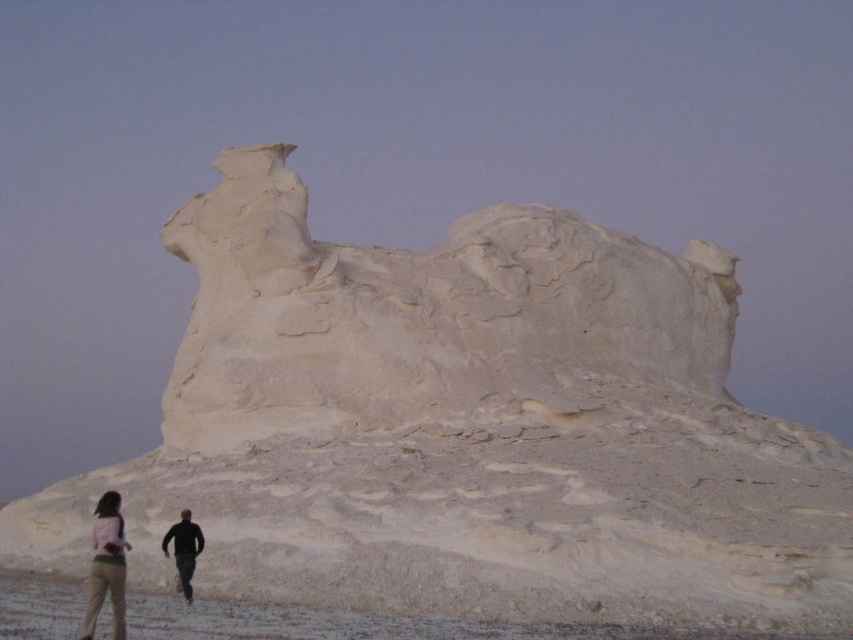
You are a photographer planning to capture the two people in the scene. Given their clothing colors and positions, which object has a smaller width between the light pink fabric pants at lower left and the matte pink shirt at lower left?

The light pink fabric pants at lower left has a lesser width compared to matte pink shirt at lower left.